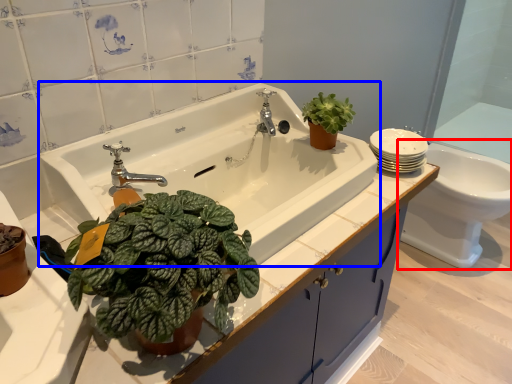
Question: Which object is further to the camera taking this photo, toilet (highlighted by a red box) or sink (highlighted by a blue box)?

Choices:
 (A) toilet
 (B) sink

Answer: (A)